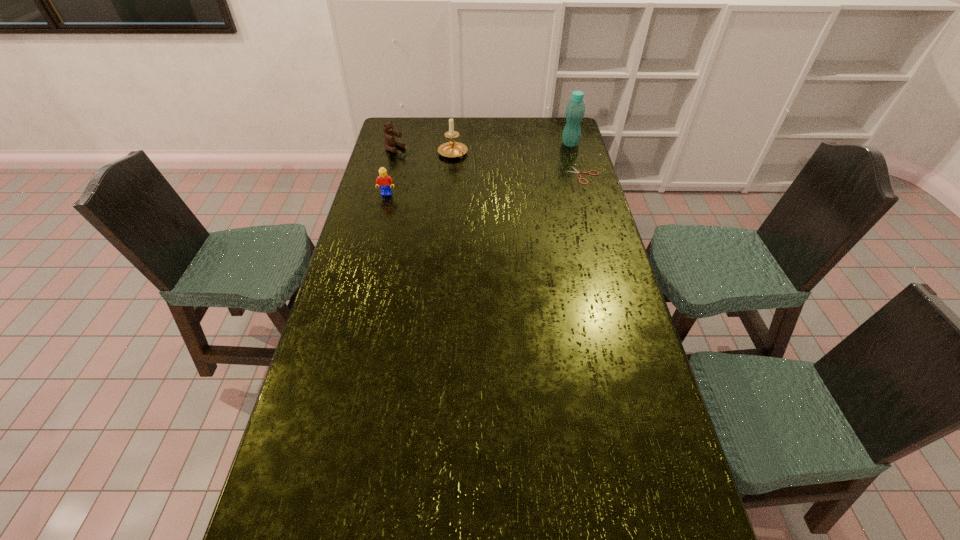
Locate an element on the screen. teddy bear at the left edge is located at coordinates (390, 141).

The height and width of the screenshot is (540, 960). Find the location of `shears at the right edge`. shears at the right edge is located at coordinates (577, 171).

The image size is (960, 540). I want to click on water bottle that is at the right edge, so [x=575, y=110].

The width and height of the screenshot is (960, 540). What are the coordinates of `object that is positioned at the far right corner` in the screenshot? It's located at (575, 110).

Locate an element on the screen. vacant space at the far edge of the desktop is located at coordinates (445, 136).

You are a GUI agent. You are given a task and a screenshot of the screen. Output one action in this format:
    pyautogui.click(x=<x>, y=<y>)
    Task: Click on the free region at the near edge of the desktop
    This screenshot has width=960, height=540.
    Given the screenshot: What is the action you would take?
    pyautogui.click(x=592, y=494)

Find the location of a particular element. The image size is (960, 540). vacant space at the left edge of the desktop is located at coordinates (351, 379).

Where is `free space at the right edge of the desktop`? The image size is (960, 540). free space at the right edge of the desktop is located at coordinates 598,400.

At what (x,y) coordinates should I click in order to perform the action: click on free space between the teddy bear and the nearest object. Please return your answer as a coordinate pair (x, y). Looking at the image, I should click on (391, 171).

What are the coordinates of `free space between the second nearest object and the nearest object` in the screenshot? It's located at (485, 185).